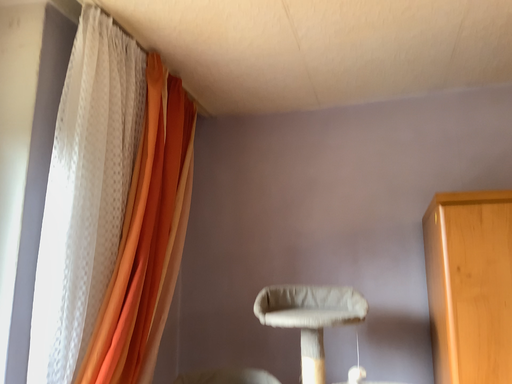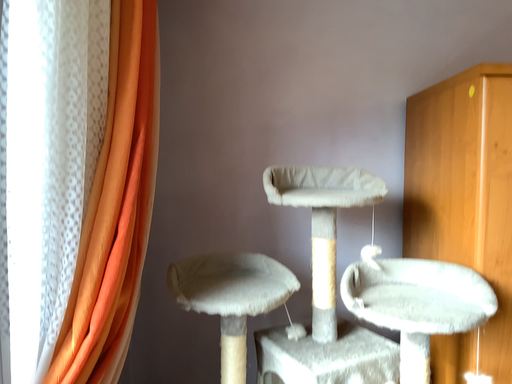
Question: Which way did the camera rotate in the video?

Choices:
 (A) rotated downward
 (B) rotated upward

Answer: (A)